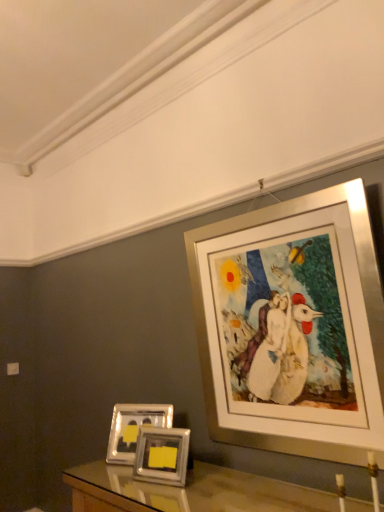
Question: Considering the relative sizes of silver metallic photo frames at lower center, placed as the second picture frame when sorted from left to right, and silver metallic picture frame at upper right, marked as the 3th picture frame in a left-to-right arrangement, in the image provided, is silver metallic photo frames at lower center, placed as the second picture frame when sorted from left to right, bigger than silver metallic picture frame at upper right, marked as the 3th picture frame in a left-to-right arrangement,?

Choices:
 (A) no
 (B) yes

Answer: (A)

Question: Does silver metallic photo frames at lower center, the 2th picture frame viewed from the right, appear on the right side of silver metallic picture frame at upper right, marked as the 3th picture frame in a left-to-right arrangement?

Choices:
 (A) no
 (B) yes

Answer: (A)

Question: Is silver metallic photo frames at lower center, the 2th picture frame viewed from the right, behind silver metallic picture frame at upper right, the 1th picture frame in the right-to-left sequence?

Choices:
 (A) yes
 (B) no

Answer: (A)

Question: Is silver metallic photo frames at lower center, the 2th picture frame viewed from the right, facing towards silver metallic picture frame at upper right, marked as the 3th picture frame in a left-to-right arrangement?

Choices:
 (A) yes
 (B) no

Answer: (B)

Question: Considering the relative sizes of silver metallic photo frames at lower center, placed as the second picture frame when sorted from left to right, and silver metallic picture frame at upper right, marked as the 3th picture frame in a left-to-right arrangement, in the image provided, is silver metallic photo frames at lower center, placed as the second picture frame when sorted from left to right, taller than silver metallic picture frame at upper right, marked as the 3th picture frame in a left-to-right arrangement,?

Choices:
 (A) yes
 (B) no

Answer: (B)

Question: Does silver metallic photo frames at lower center, placed as the second picture frame when sorted from left to right, have a lesser width compared to silver metallic picture frame at upper right, marked as the 3th picture frame in a left-to-right arrangement?

Choices:
 (A) no
 (B) yes

Answer: (B)

Question: Is metallic silver picture frame at lower left, the third picture frame positioned from the right, facing away from silver metallic picture frame at upper right, the 1th picture frame in the right-to-left sequence?

Choices:
 (A) yes
 (B) no

Answer: (B)

Question: Does metallic silver picture frame at lower left, the third picture frame positioned from the right, turn towards silver metallic picture frame at upper right, marked as the 3th picture frame in a left-to-right arrangement?

Choices:
 (A) no
 (B) yes

Answer: (A)

Question: Would you consider metallic silver picture frame at lower left, the third picture frame positioned from the right, to be distant from silver metallic picture frame at upper right, marked as the 3th picture frame in a left-to-right arrangement?

Choices:
 (A) yes
 (B) no

Answer: (B)

Question: Considering the relative sizes of metallic silver picture frame at lower left, the third picture frame positioned from the right, and silver metallic picture frame at upper right, marked as the 3th picture frame in a left-to-right arrangement, in the image provided, is metallic silver picture frame at lower left, the third picture frame positioned from the right, thinner than silver metallic picture frame at upper right, marked as the 3th picture frame in a left-to-right arrangement,?

Choices:
 (A) yes
 (B) no

Answer: (B)

Question: From a real-world perspective, is metallic silver picture frame at lower left, the third picture frame positioned from the right, located higher than silver metallic picture frame at upper right, the 1th picture frame in the right-to-left sequence?

Choices:
 (A) no
 (B) yes

Answer: (A)

Question: Does metallic silver picture frame at lower left, the 1th picture frame positioned from the left, have a greater width compared to silver metallic picture frame at upper right, the 1th picture frame in the right-to-left sequence?

Choices:
 (A) no
 (B) yes

Answer: (B)

Question: Does silver metallic picture frame at upper right, marked as the 3th picture frame in a left-to-right arrangement, have a greater width compared to silver metallic photo frames at lower center, placed as the second picture frame when sorted from left to right?

Choices:
 (A) no
 (B) yes

Answer: (B)